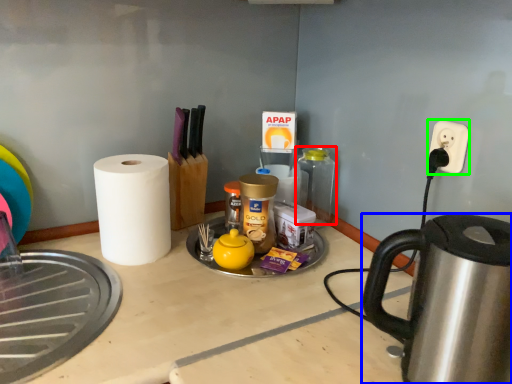
Question: Which object is positioned farthest from bottle (highlighted by a red box)? Select from kettle (highlighted by a blue box) and electric outlet (highlighted by a green box).

Choices:
 (A) kettle
 (B) electric outlet

Answer: (A)